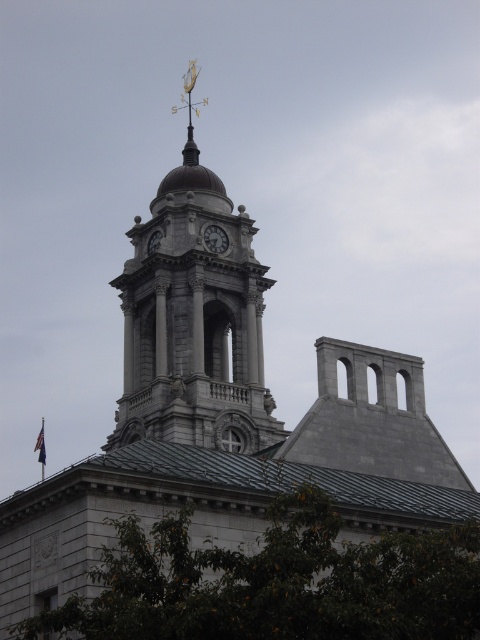
Between point (418, 580) and point (201, 188), which one is positioned in front?

Point (418, 580) is more forward.

Is point (317, 625) closer to viewer compared to point (120, 440)?

Yes, point (317, 625) is closer to viewer.

I want to click on green leafy tree at lower center, so click(276, 582).

Does point (311, 544) come in front of point (45, 452)?

That is True.

Locate an element on the screen. green leafy tree at lower center is located at coordinates (276, 582).

Is blue fabric flag at upper left below silver metallic clock at center?

Yes.

Measure the distance between point (41, 468) and camera.

Point (41, 468) and camera are 485.70 feet apart from each other.

What do you see at coordinates (40, 445) in the screenshot? The width and height of the screenshot is (480, 640). I see `blue fabric flag at upper left` at bounding box center [40, 445].

Where is `blue fabric flag at upper left`? The width and height of the screenshot is (480, 640). blue fabric flag at upper left is located at coordinates (40, 445).